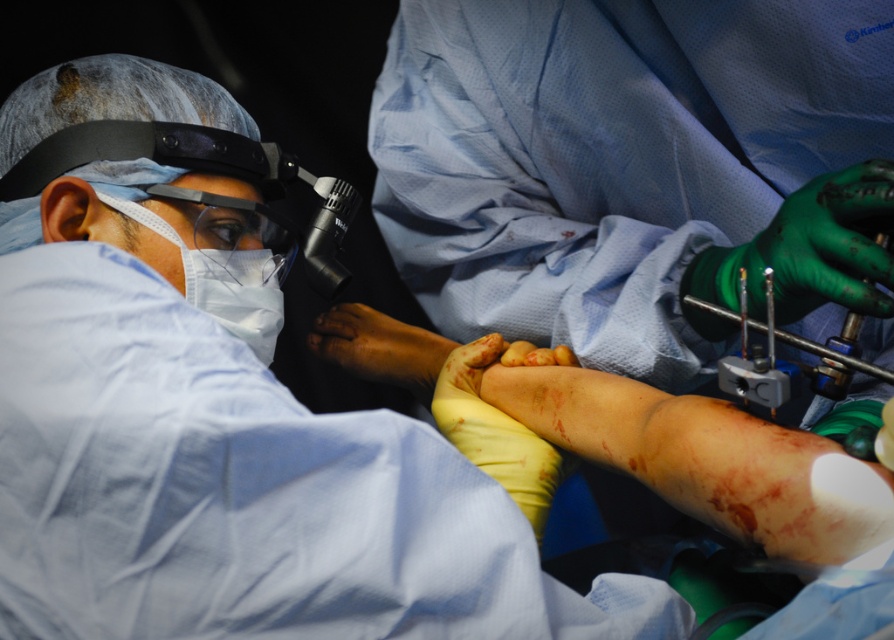
Can you confirm if white matte mask at center is positioned below white matte mask at left?

Correct, white matte mask at center is located below white matte mask at left.

Does white matte mask at center have a lesser width compared to white matte mask at left?

Indeed, white matte mask at center has a lesser width compared to white matte mask at left.

Between point (256, 330) and point (268, 355), which one is positioned behind?

The point (268, 355) is behind.

I want to click on white matte mask at center, so click(237, 291).

Locate an element on the screen. metallic gray surgical instrument at center-right is located at coordinates (785, 360).

Is metallic gray surgical instrument at center-right bigger than white matte mask at left?

Yes, metallic gray surgical instrument at center-right is bigger than white matte mask at left.

This screenshot has height=640, width=894. I want to click on metallic gray surgical instrument at center-right, so click(785, 360).

In order to click on metallic gray surgical instrument at center-right in this screenshot , I will do `click(785, 360)`.

Does metallic gray surgical instrument at center-right appear over white matte mask at center?

No, metallic gray surgical instrument at center-right is not above white matte mask at center.

Does metallic gray surgical instrument at center-right lie in front of white matte mask at center?

Yes, it is.

Find the location of `metallic gray surgical instrument at center-right`. metallic gray surgical instrument at center-right is located at coordinates (785, 360).